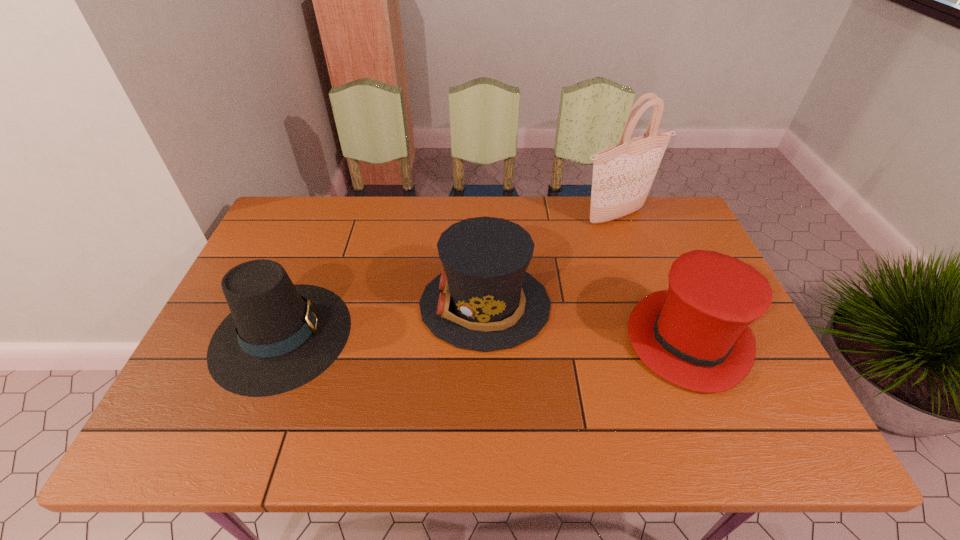
At what (x,y) coordinates should I click in order to perform the action: click on free region located 0.230m on the front-facing side of the leftmost object. Please return your answer as a coordinate pair (x, y). Looking at the image, I should click on (440, 334).

Where is `object that is at the far edge`? The image size is (960, 540). object that is at the far edge is located at coordinates (623, 174).

This screenshot has width=960, height=540. What are the coordinates of `object that is at the left edge` in the screenshot? It's located at (279, 336).

Where is `shopping bag situated at the right edge`? The height and width of the screenshot is (540, 960). shopping bag situated at the right edge is located at coordinates (623, 174).

This screenshot has height=540, width=960. What are the coordinates of `hat that is at the right edge` in the screenshot? It's located at (695, 335).

The image size is (960, 540). I want to click on object present at the far right corner, so click(x=623, y=174).

Where is `free point at the far edge`? free point at the far edge is located at coordinates click(611, 230).

The height and width of the screenshot is (540, 960). What are the coordinates of `free space at the near edge` in the screenshot? It's located at (276, 451).

In the image, there is a desktop. Identify the location of vacant space at the left edge. This screenshot has height=540, width=960. (281, 245).

What are the coordinates of `vacant space at the far right corner` in the screenshot? It's located at (676, 229).